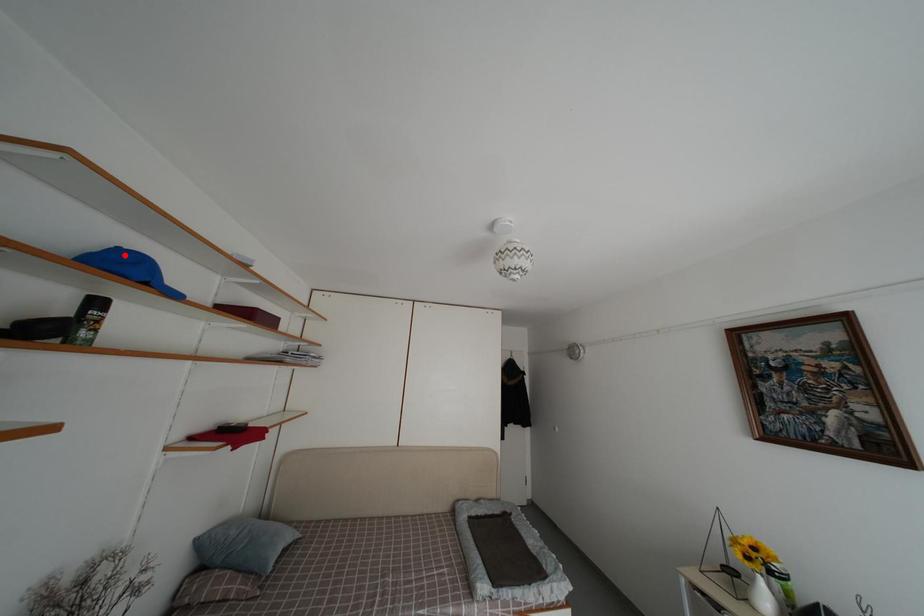
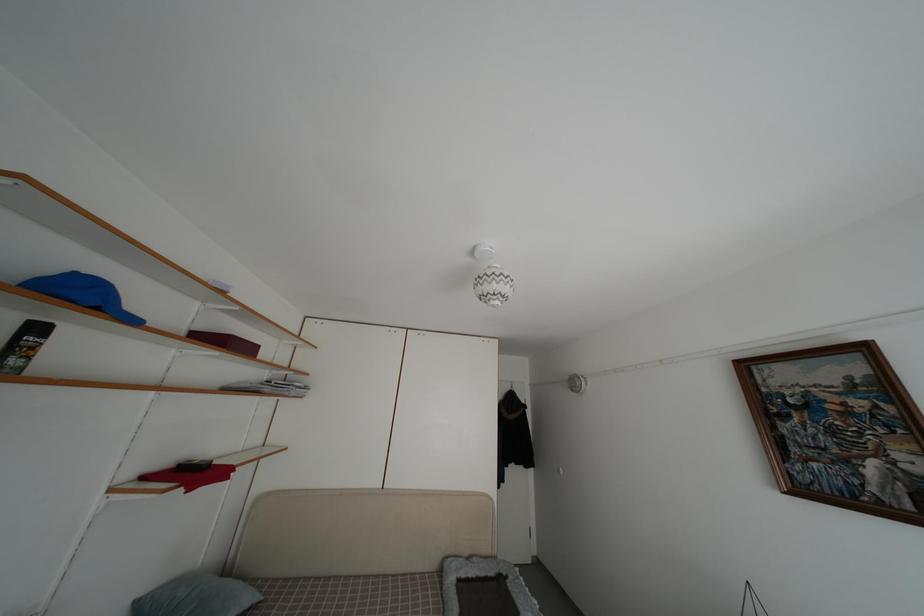
Find the pixel in the second image that matches the highlighted location in the first image.

(81, 280)